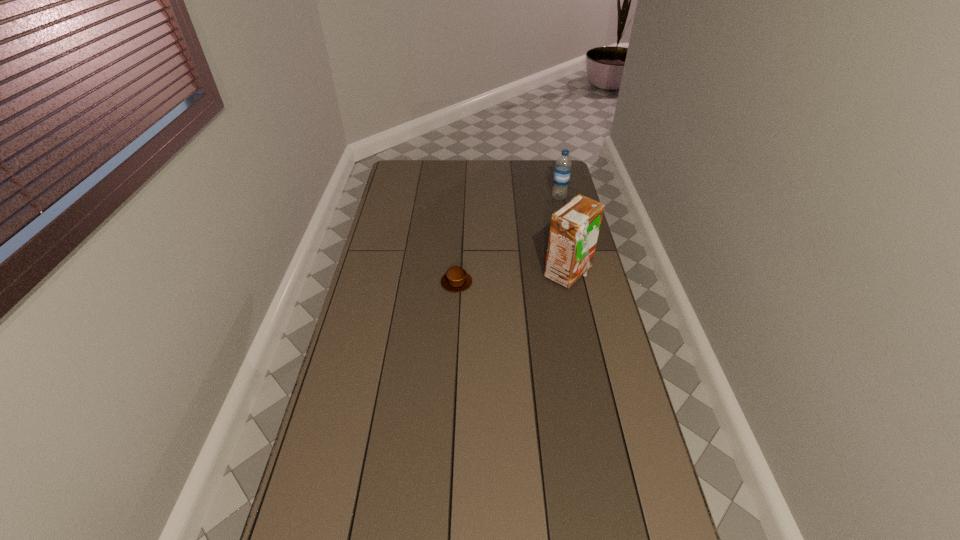
The image size is (960, 540). In order to click on water bottle present at the right edge in this screenshot , I will do `click(562, 170)`.

This screenshot has height=540, width=960. Identify the location of vacant space at the far edge of the desktop. (495, 172).

The image size is (960, 540). Identify the location of vacant space at the near edge. (458, 517).

In the image, there is a desktop. What are the coordinates of `vacant space at the left edge` in the screenshot? It's located at 393,233.

In the image, there is a desktop. Where is `vacant space at the right edge`? This screenshot has height=540, width=960. vacant space at the right edge is located at coordinates (610, 433).

In the image, there is a desktop. Where is `free space at the far left corner`? Image resolution: width=960 pixels, height=540 pixels. free space at the far left corner is located at coordinates (421, 163).

Find the location of a particular element. The image size is (960, 540). object that can be found as the closest to the muffin is located at coordinates (574, 230).

Find the location of a particular element. object that stands as the second closest to the leftmost object is located at coordinates (562, 170).

I want to click on vacant space that satisfies the following two spatial constraints: 1. on the back side of the water bottle; 2. on the right side of the muffin, so click(x=462, y=197).